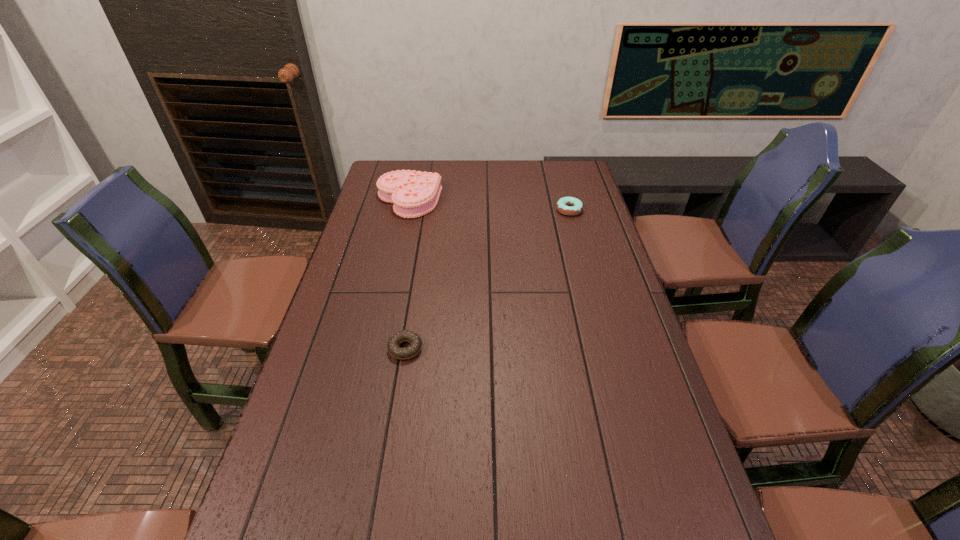
Locate an element on the screen. This screenshot has height=540, width=960. object present at the right edge is located at coordinates (570, 206).

The width and height of the screenshot is (960, 540). Identify the location of object located in the far left corner section of the desktop. (414, 194).

The width and height of the screenshot is (960, 540). I want to click on free region at the far edge of the desktop, so click(x=492, y=177).

This screenshot has width=960, height=540. In order to click on vacant space at the left edge in this screenshot , I will do `click(279, 510)`.

What are the coordinates of `free space at the right edge of the desktop` in the screenshot? It's located at (571, 247).

This screenshot has width=960, height=540. I want to click on free location at the far right corner, so click(x=552, y=188).

The width and height of the screenshot is (960, 540). Identify the location of vacant area that lies between the rightmost object and the nearer doughnut. (488, 279).

The image size is (960, 540). In order to click on vacant point located between the left doughnut and the tallest object in this screenshot , I will do `click(407, 274)`.

Where is `free point between the left doughnut and the cake`? This screenshot has width=960, height=540. free point between the left doughnut and the cake is located at coordinates (407, 274).

This screenshot has height=540, width=960. In order to click on vacant space that is in between the nearer doughnut and the cake in this screenshot , I will do `click(407, 274)`.